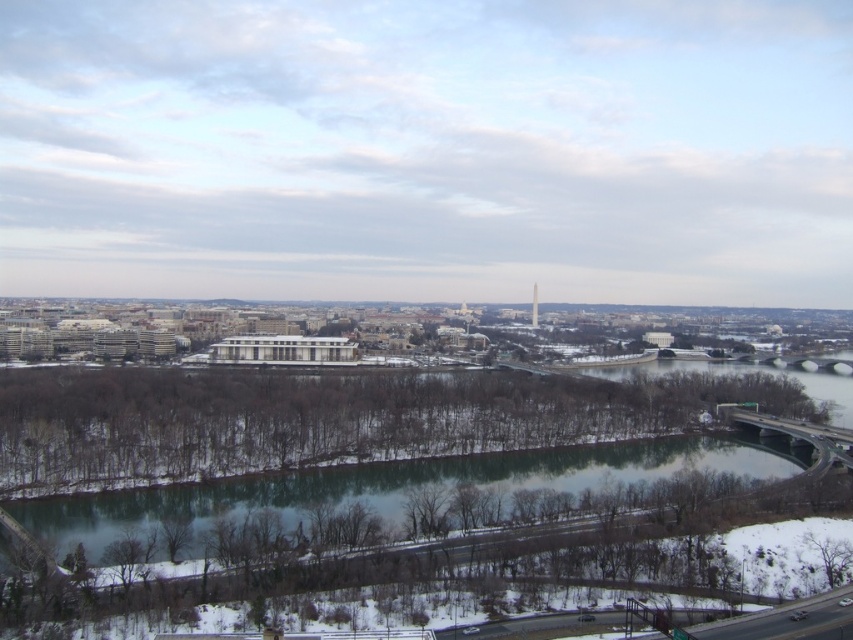
You are standing at the edge of the snowy white river at center in the cityscape. A friend is standing 100 meters away from you along the same path. Can they see the leafless trees on the riverbanks clearly from their position?

The snowy white river at center is 87.51 meters away from the viewer. Since your friend is 100 meters away from you, their distance from the river would be 87.51 meters plus 100 meters, totaling 187.51 meters. At this distance, the leafless trees on the riverbanks might appear small and less detailed, making it difficult for them to see them clearly.